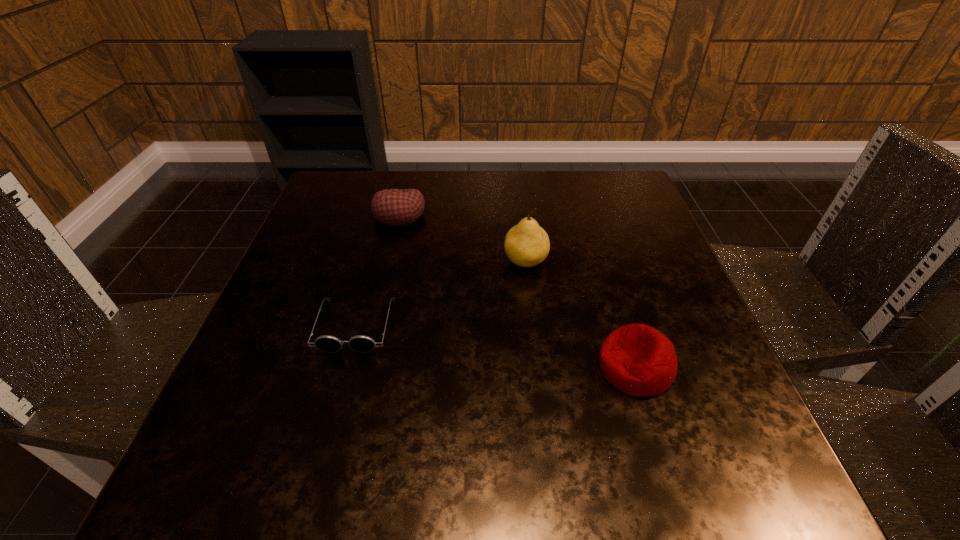
Locate an element on the screen. This screenshot has width=960, height=540. free point between the third nearest object and the farther beanbag is located at coordinates coord(463,238).

The width and height of the screenshot is (960, 540). Identify the location of free spot between the nearer beanbag and the tallest object. (580, 314).

At what (x,y) coordinates should I click in order to perform the action: click on vacant area that lies between the left beanbag and the sunglasses. Please return your answer as a coordinate pair (x, y). This screenshot has height=540, width=960. Looking at the image, I should click on (377, 270).

What are the coordinates of `unoccupied area between the rightmost object and the tallest object` in the screenshot? It's located at (580, 314).

Identify the location of the second closest object relative to the nearer beanbag. (360, 343).

Locate which object ranks in proximity to the shortest object. Please provide its 2D coordinates. Your answer should be formatted as a tuple, i.e. [(x, y)], where the tuple contains the x and y coordinates of a point satisfying the conditions above.

[(396, 207)]